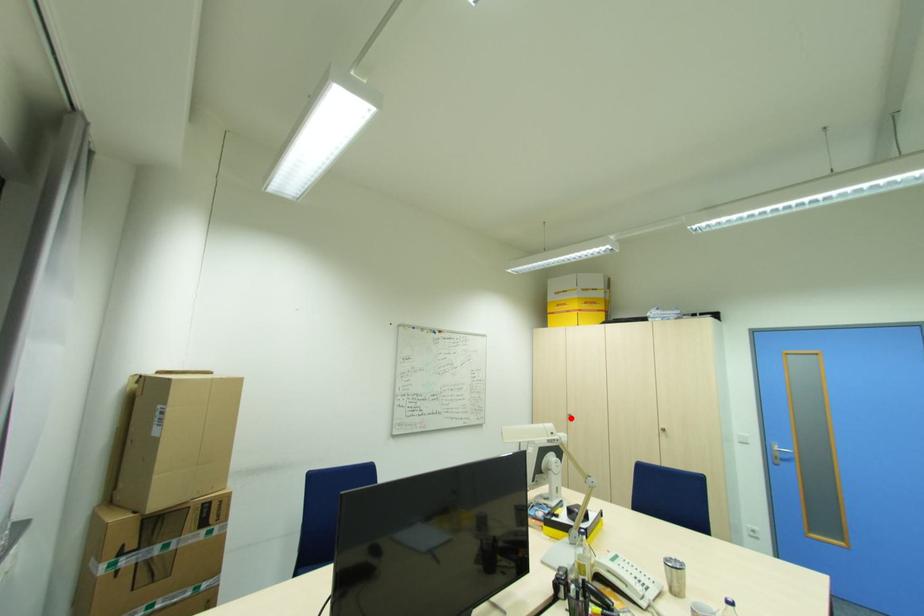
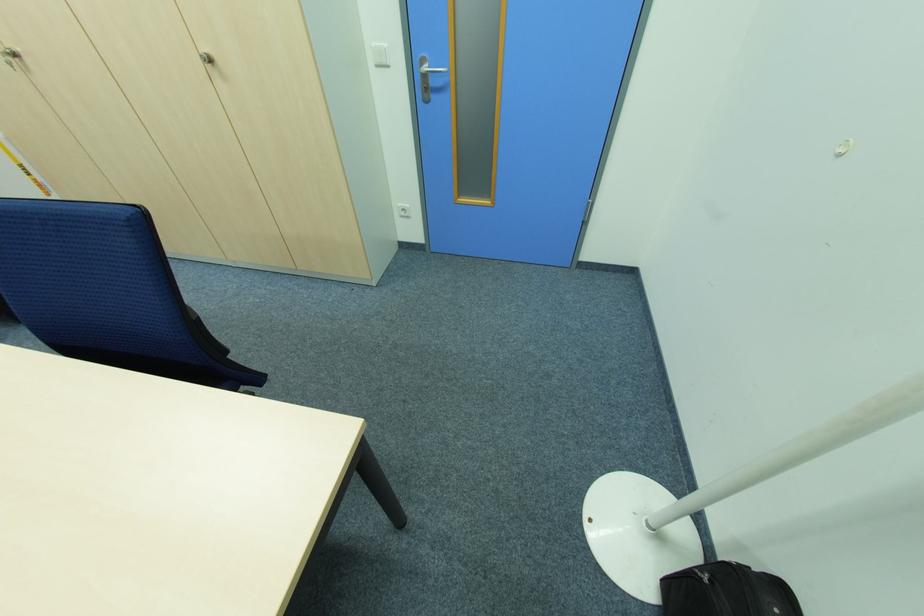
Question: I am providing you with two images of the same scene from different viewpoints. A red point is marked on the first image. Is the red point's position out of view in image 2?

Choices:
 (A) Yes
 (B) No

Answer: (B)